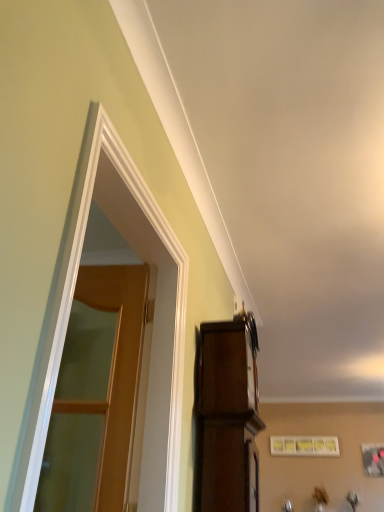
Question: Should I look upward or downward to see matte white picture frame at upper center?

Choices:
 (A) down
 (B) up

Answer: (A)

Question: Does dark wood cabinet at upper right come in front of white glossy door at left?

Choices:
 (A) yes
 (B) no

Answer: (B)

Question: Is dark wood cabinet at upper right located outside white glossy door at left?

Choices:
 (A) yes
 (B) no

Answer: (A)

Question: Is dark wood cabinet at upper right far away from white glossy door at left?

Choices:
 (A) no
 (B) yes

Answer: (A)

Question: Can you confirm if dark wood cabinet at upper right is positioned to the left of white glossy door at left?

Choices:
 (A) yes
 (B) no

Answer: (B)

Question: Considering the relative positions of dark wood cabinet at upper right and white glossy door at left in the image provided, is dark wood cabinet at upper right to the right of white glossy door at left from the viewer's perspective?

Choices:
 (A) yes
 (B) no

Answer: (A)

Question: Can you confirm if dark wood cabinet at upper right is smaller than white glossy door at left?

Choices:
 (A) no
 (B) yes

Answer: (B)

Question: From the image's perspective, is white glossy door at left over wooden at left?

Choices:
 (A) yes
 (B) no

Answer: (A)

Question: Is the depth of white glossy door at left greater than that of wooden at left?

Choices:
 (A) yes
 (B) no

Answer: (B)

Question: Is white glossy door at left turned away from wooden at left?

Choices:
 (A) no
 (B) yes

Answer: (B)

Question: From a real-world perspective, does white glossy door at left sit lower than wooden at left?

Choices:
 (A) no
 (B) yes

Answer: (A)

Question: Considering the relative positions of white glossy door at left and wooden at left in the image provided, is white glossy door at left in front of wooden at left?

Choices:
 (A) yes
 (B) no

Answer: (A)

Question: From the image's perspective, is white glossy door at left under wooden at left?

Choices:
 (A) no
 (B) yes

Answer: (A)

Question: Is matte white picture frame at upper center placed right next to wooden at left?

Choices:
 (A) yes
 (B) no

Answer: (B)